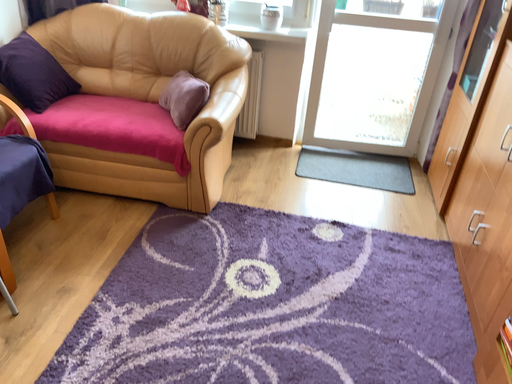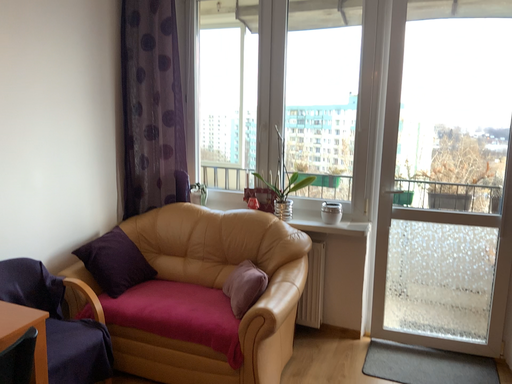
Question: Which way did the camera rotate in the video?

Choices:
 (A) rotated upward
 (B) rotated downward

Answer: (A)